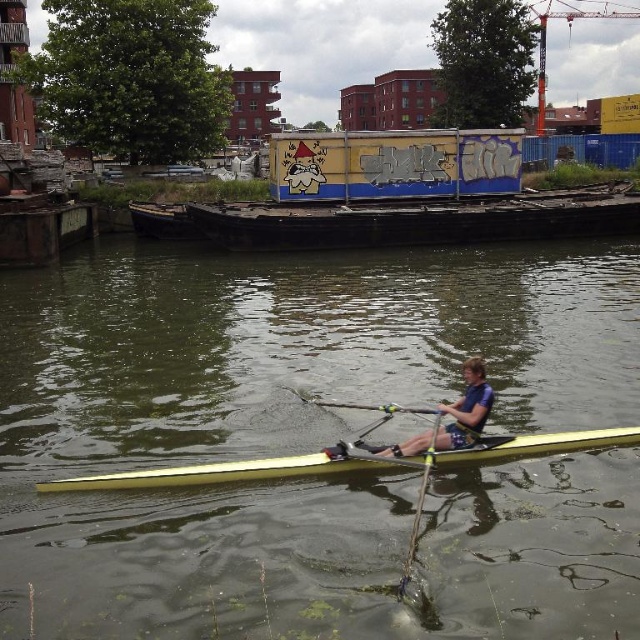
Between blue fabric life vest at center and yellow wood paddle at center, which one has less height?

Standing shorter between the two is yellow wood paddle at center.

Who is more forward, (467, 435) or (497, 435)?

Point (467, 435) is in front.

Who is more forward, (486, 412) or (320, 401)?

Point (486, 412) is more forward.

Locate an element on the screen. blue fabric life vest at center is located at coordinates (454, 417).

Between wooden boat at center and yellow wood paddle at center, which one has less height?

A: yellow wood paddle at center

Does wooden boat at center have a greater width compared to yellow wood paddle at center?

Yes.

Is point (262, 224) behind point (330, 401)?

Yes, it is.

This screenshot has height=640, width=640. Identify the location of wooden boat at center. click(420, 220).

Between yellow glossy canoe at center and yellow wood paddle at center, which one has less height?

yellow glossy canoe at center

What do you see at coordinates (225, 472) in the screenshot? I see `yellow glossy canoe at center` at bounding box center [225, 472].

Which is in front, point (497, 438) or point (312, 403)?

Point (497, 438)

Image resolution: width=640 pixels, height=640 pixels. In order to click on yellow glossy canoe at center in this screenshot , I will do `click(225, 472)`.